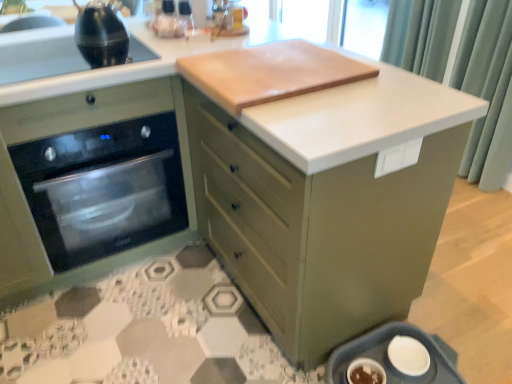
Question: From a real-world perspective, is green fabric curtain at upper right positioned over matte green trash can at lower right based on gravity?

Choices:
 (A) no
 (B) yes

Answer: (B)

Question: Can matte green trash can at lower right be found inside green fabric curtain at upper right?

Choices:
 (A) no
 (B) yes

Answer: (A)

Question: From a real-world perspective, is green fabric curtain at upper right physically below matte green trash can at lower right?

Choices:
 (A) no
 (B) yes

Answer: (A)

Question: Does green fabric curtain at upper right have a greater width compared to matte green trash can at lower right?

Choices:
 (A) no
 (B) yes

Answer: (A)

Question: Is green fabric curtain at upper right located outside matte green trash can at lower right?

Choices:
 (A) no
 (B) yes

Answer: (B)

Question: Does green fabric curtain at upper right appear on the left side of matte green trash can at lower right?

Choices:
 (A) no
 (B) yes

Answer: (A)

Question: Does black glass sink at upper left turn towards light brown wood cutting board at upper center?

Choices:
 (A) yes
 (B) no

Answer: (B)

Question: From a real-world perspective, is black glass sink at upper left under light brown wood cutting board at upper center?

Choices:
 (A) yes
 (B) no

Answer: (A)

Question: Is black glass sink at upper left closer to camera compared to light brown wood cutting board at upper center?

Choices:
 (A) yes
 (B) no

Answer: (B)

Question: Is black glass sink at upper left located outside light brown wood cutting board at upper center?

Choices:
 (A) yes
 (B) no

Answer: (A)

Question: Does black glass sink at upper left contain light brown wood cutting board at upper center?

Choices:
 (A) no
 (B) yes

Answer: (A)

Question: Can you see black glass sink at upper left touching light brown wood cutting board at upper center?

Choices:
 (A) yes
 (B) no

Answer: (B)

Question: Does black glass sink at upper left have a larger size compared to black glass oven at left?

Choices:
 (A) no
 (B) yes

Answer: (A)